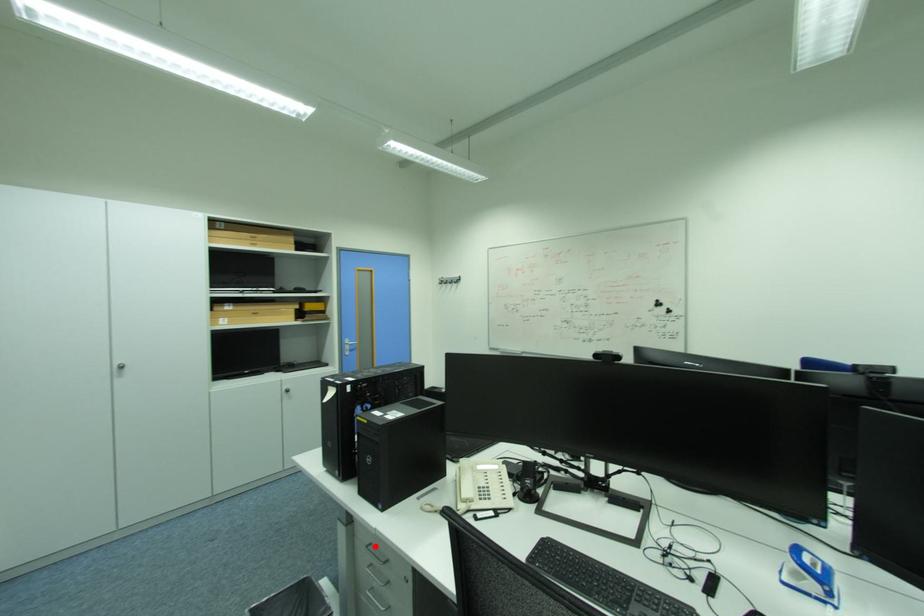
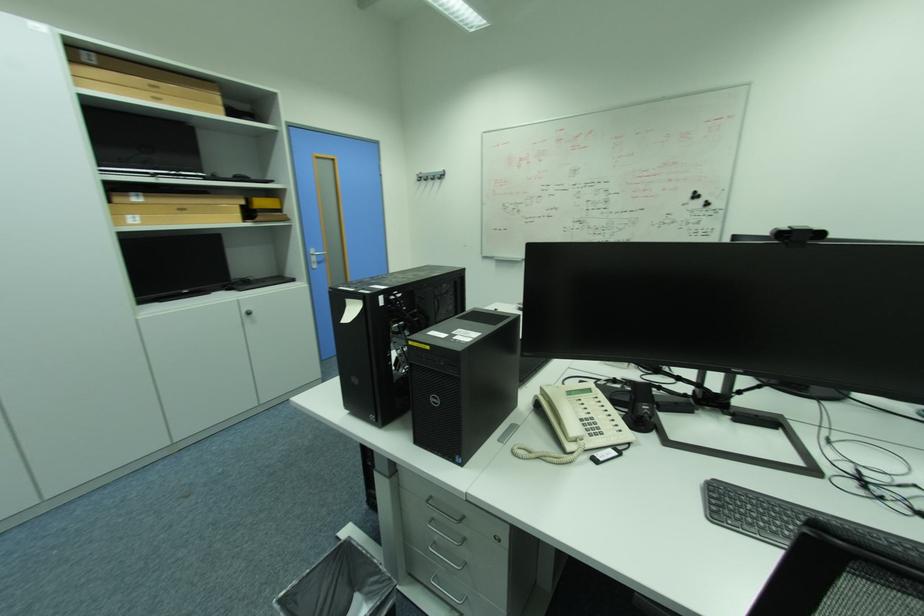
In the second image, find the point that corresponds to the highlighted location in the first image.

(435, 501)